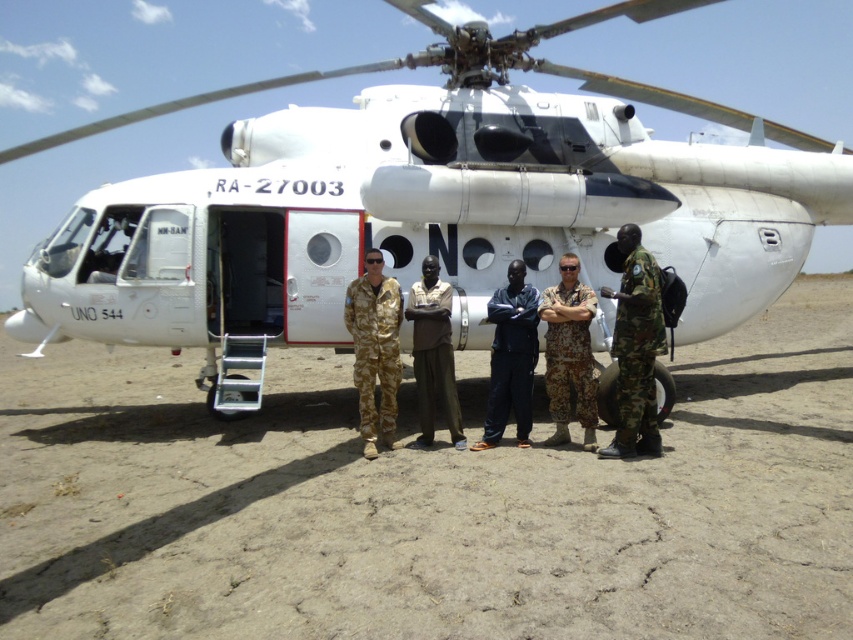
Does dull brown dirt at center appear under brown fabric pants at center?

Indeed, dull brown dirt at center is positioned under brown fabric pants at center.

Which is in front, point (155, 524) or point (428, 296)?

Positioned in front is point (155, 524).

Between point (775, 451) and point (419, 346), which one is positioned in front?

Point (775, 451)

The height and width of the screenshot is (640, 853). I want to click on dull brown dirt at center, so click(x=428, y=502).

Who is more distant from viewer, (572, 353) or (496, 387)?

Point (496, 387)

Is point (556, 326) closer to camera compared to point (514, 305)?

Yes, it is in front of point (514, 305).

I want to click on camouflage fabric pants at center, so click(x=569, y=353).

What are the coordinates of `camouflage fabric pants at center` in the screenshot? It's located at (569, 353).

Is white matte helicopter at center smaller than camouflage uniform at center?

Incorrect, white matte helicopter at center is not smaller in size than camouflage uniform at center.

Describe the element at coordinates (424, 202) in the screenshot. The width and height of the screenshot is (853, 640). I see `white matte helicopter at center` at that location.

Find the location of a particular element. The width and height of the screenshot is (853, 640). white matte helicopter at center is located at coordinates (424, 202).

Locate an element on the screen. white matte helicopter at center is located at coordinates (424, 202).